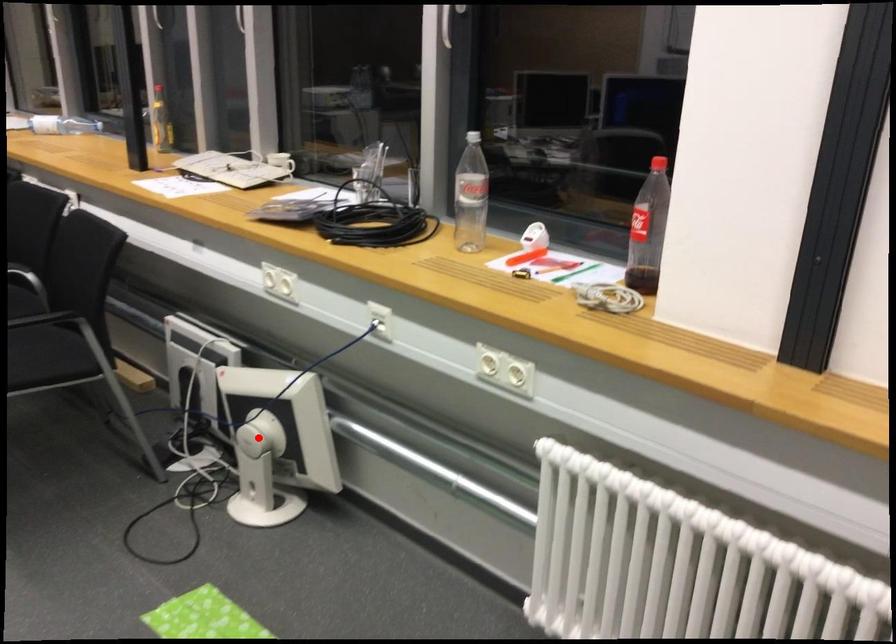
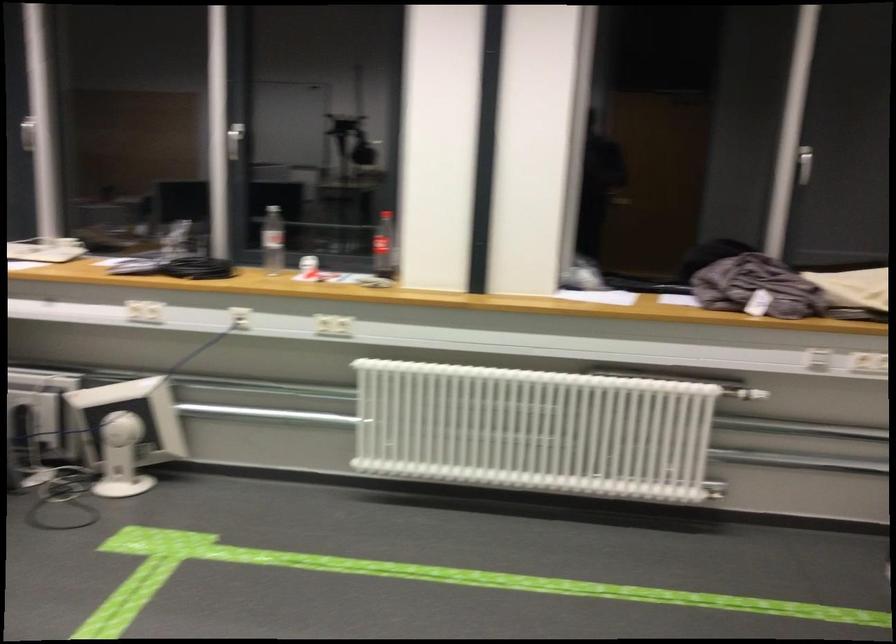
The point at the highlighted location is marked in the first image. Where is the corresponding point in the second image?

(126, 431)